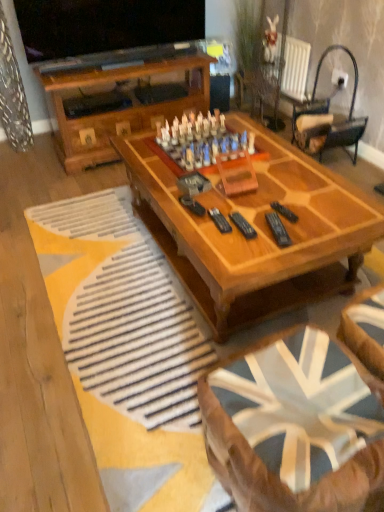
Where is `vacant area that lies between black plastic remote at center, marked as the 1th remote in a left-to-right arrangement, and wooden chess set at center`? Image resolution: width=384 pixels, height=512 pixels. vacant area that lies between black plastic remote at center, marked as the 1th remote in a left-to-right arrangement, and wooden chess set at center is located at coordinates (238, 192).